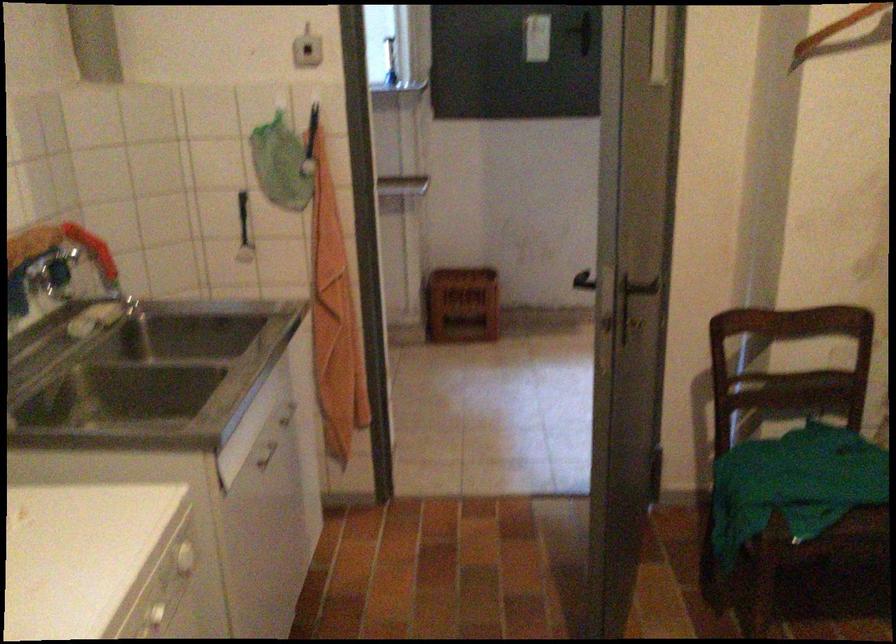
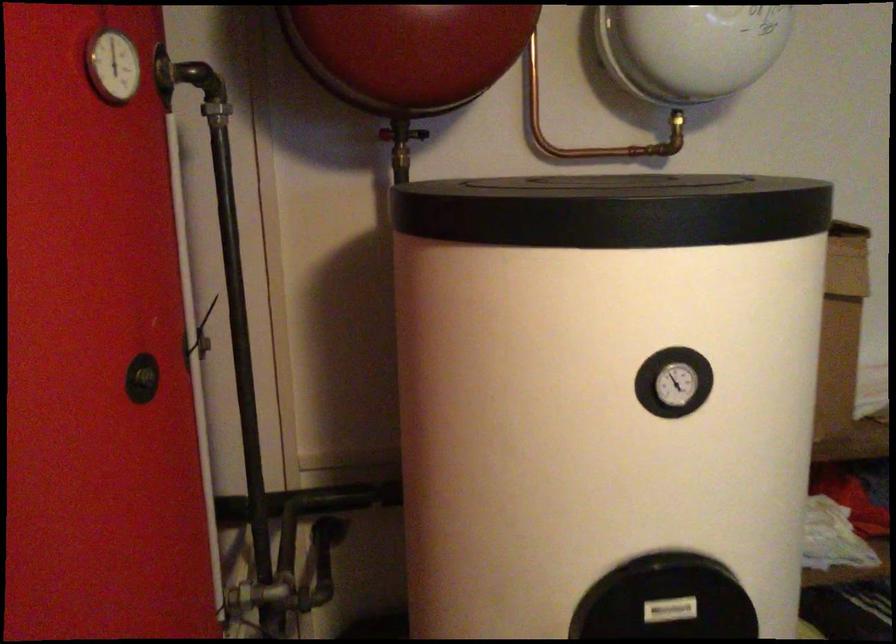
Question: The images are taken continuously from a first-person perspective. In which direction are you moving?

Choices:
 (A) Left
 (B) Right
 (C) Forward
 (D) Backward

Answer: (B)